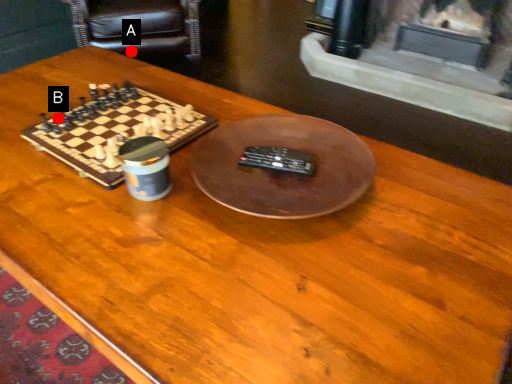
Question: Two points are circled on the image, labeled by A and B beside each circle. Which point is farther to the camera?

Choices:
 (A) A is further
 (B) B is further

Answer: (A)